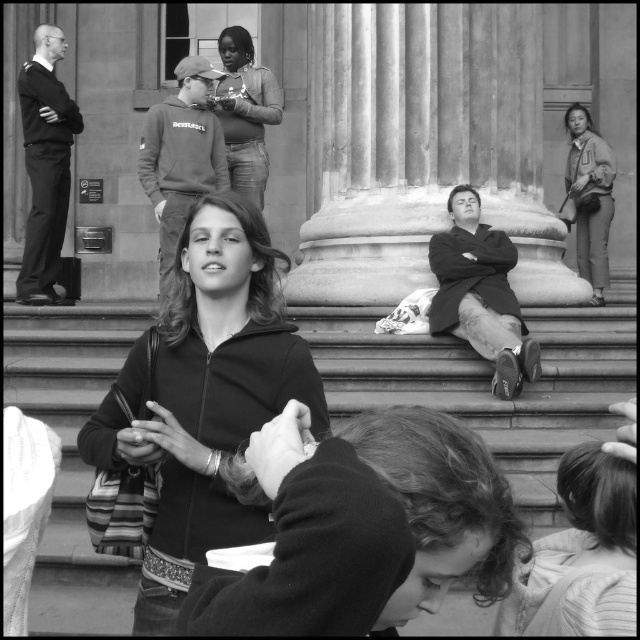
Question: Which point is closer to the camera?

Choices:
 (A) (32, 333)
 (B) (596, 144)

Answer: (A)

Question: Is black matte jacket at center above matte brown jacket at right?

Choices:
 (A) no
 (B) yes

Answer: (A)

Question: Estimate the real-world distances between objects in this image. Which object is farther from the smooth concrete stairs at lower center?

Choices:
 (A) black matte jacket at center
 (B) matte brown jacket at right

Answer: (A)

Question: Can you confirm if matte black hoodie at center is bigger than matte brown jacket at right?

Choices:
 (A) no
 (B) yes

Answer: (B)

Question: Does black matte jacket at center appear on the left side of matte black hoodie at center?

Choices:
 (A) yes
 (B) no

Answer: (A)

Question: Among these points, which one is nearest to the camera?

Choices:
 (A) (586, 134)
 (B) (92, 412)

Answer: (B)